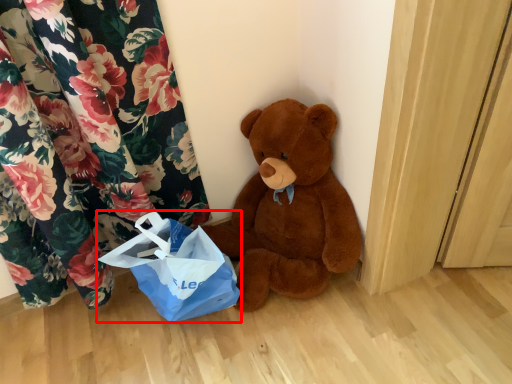
Question: Considering the relative positions of grocery bag (annotated by the red box) and teddy bear in the image provided, where is grocery bag (annotated by the red box) located with respect to the staircase?

Choices:
 (A) left
 (B) right

Answer: (A)